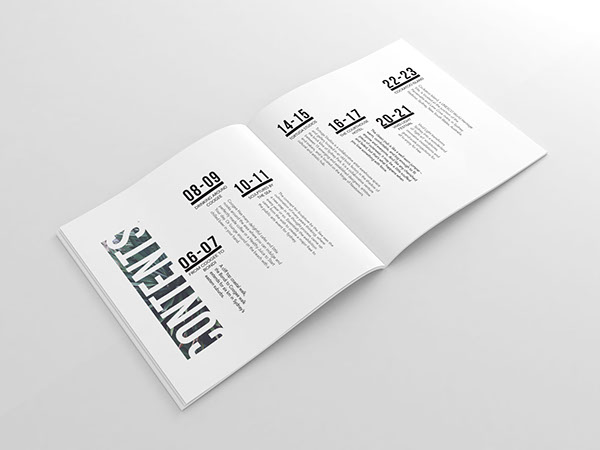
The width and height of the screenshot is (600, 450). Find the location of `book`. book is located at coordinates (321, 278), (449, 198), (361, 86), (173, 179).